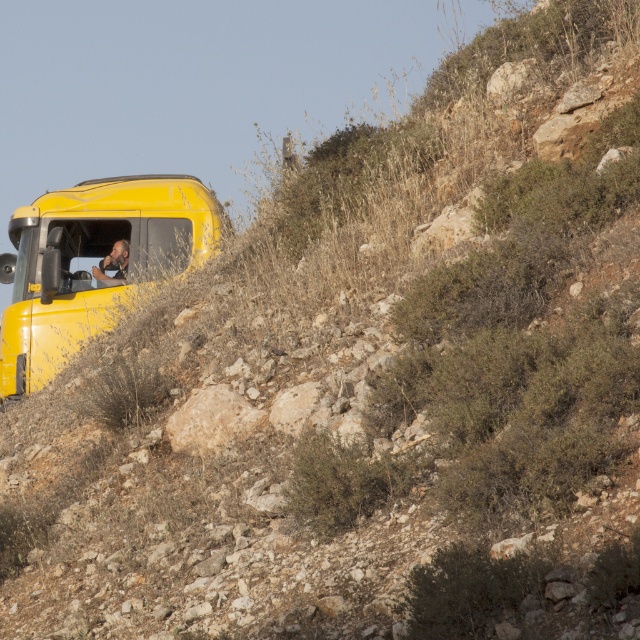
You are a hiker planning to walk from the shiny yellow truck at upper left to the camouflage uniform at left. Considering the terrain, which path would require more climbing effort?

The path from the shiny yellow truck at upper left to the camouflage uniform at left would require more climbing effort because the shiny yellow truck at upper left is much taller than the camouflage uniform at left, indicating a downward slope.

You are a hiker trying to locate your friend who is wearing a camouflage uniform at left. You see the shiny yellow truck at upper left. Which object is higher up in the scene?

The shiny yellow truck at upper left is positioned over camouflage uniform at left, so the shiny yellow truck at upper left is higher up in the scene.